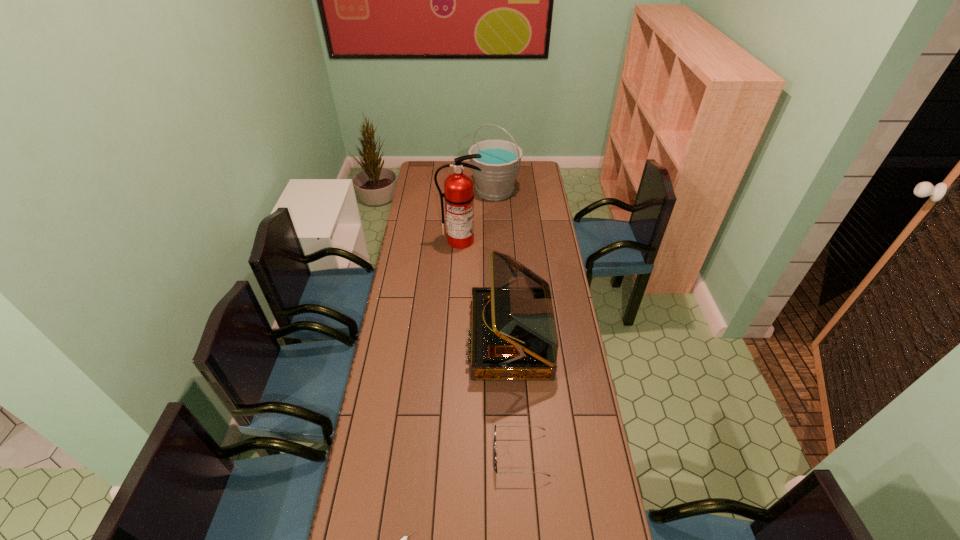
The width and height of the screenshot is (960, 540). In order to click on the tallest object in this screenshot , I will do `click(458, 193)`.

The width and height of the screenshot is (960, 540). Identify the location of fire extinguisher. (458, 193).

Identify the location of the farthest object. The image size is (960, 540). (500, 163).

The height and width of the screenshot is (540, 960). I want to click on the fourth shortest object, so click(500, 163).

At what (x,y) coordinates should I click in order to perform the action: click on the third shortest object. Please return your answer as a coordinate pair (x, y). The height and width of the screenshot is (540, 960). Looking at the image, I should click on (514, 336).

Identify the location of the third nearest object. (514, 336).

Locate an element on the screen. The height and width of the screenshot is (540, 960). the fourth farthest object is located at coordinates (495, 453).

Image resolution: width=960 pixels, height=540 pixels. What are the coordinates of `spectacles` in the screenshot? It's located at (495, 453).

This screenshot has height=540, width=960. Find the location of `vacant area located at the nozzle of the fire extinguisher`. vacant area located at the nozzle of the fire extinguisher is located at coordinates (459, 275).

The width and height of the screenshot is (960, 540). Find the location of `vacant space situated 0.230m on the front of the farthest object`. vacant space situated 0.230m on the front of the farthest object is located at coordinates coord(496,231).